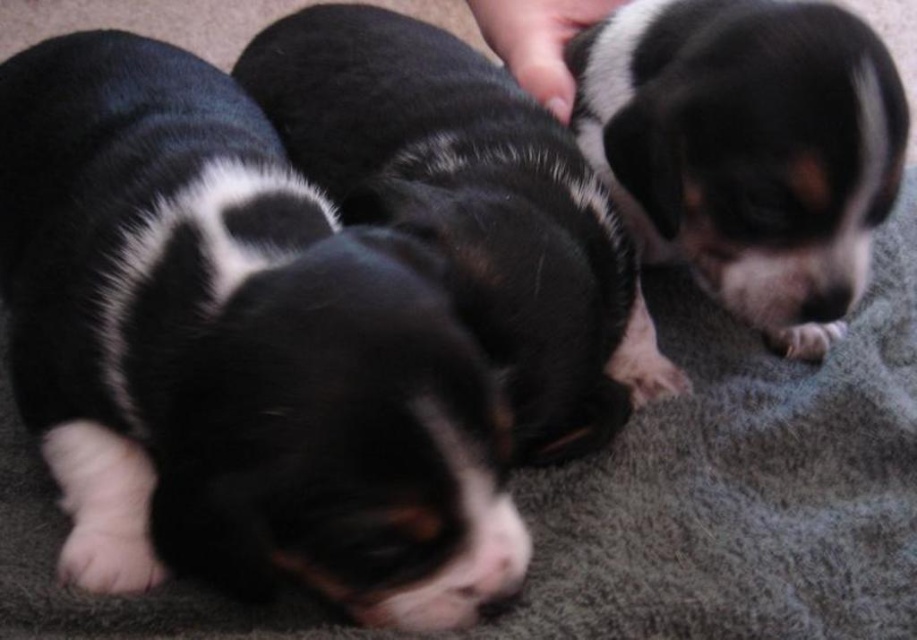
You are a photographer trying to capture a closeup shot of the black fur puppy at center and the black and white fur at center. Since you want both puppies to be in focus, which one should you adjust your camera focus to prioritize based on their sizes?

The black fur puppy at center is larger than black and white fur at center, so you should prioritize focusing on the black fur puppy at center to ensure both are in focus.

You are a dog trainer who needs to separate two puppies for feeding. The black fur puppy at center and the black and white fur at center are currently resting together. Can you safely place a divider between them without disturbing them, given that the divider requires 14 inches of space between the puppies?

The black fur puppy at center and the black and white fur at center are 13.99 inches apart, which is slightly less than the required 14 inches for the divider. Therefore, it might not be possible to safely place the divider without moving them closer together or adjusting the divider size.

You want to place a small toy on the soft gray carpet at center without it overlapping the black and white fur at center. Based on the scene description, can the toy fit on the carpet without overlapping?

The soft gray carpet at center might be wider than black and white fur at center, so there is a possibility the toy can fit without overlapping, but it depends on their exact dimensions.